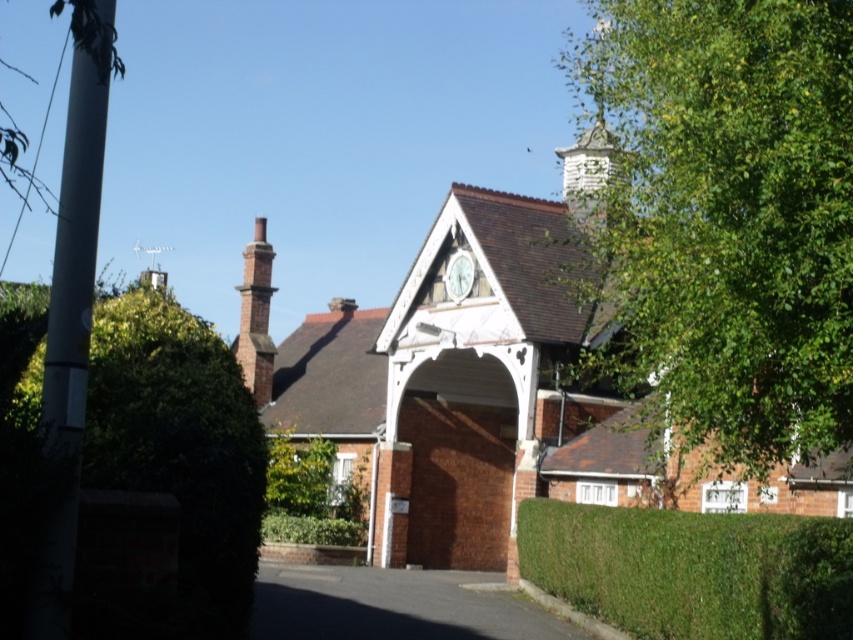
Question: Does green leafy hedge at lower right have a greater width compared to white textured chimney at upper right?

Choices:
 (A) no
 (B) yes

Answer: (A)

Question: Estimate the real-world distances between objects in this image. Which object is closer to the green leafy hedge at lower right?

Choices:
 (A) brick chimney at center-left
 (B) dark gray asphalt at center
 (C) white textured chimney at upper right
 (D) white plastic pole at left

Answer: (B)

Question: Which point is closer to the camera?

Choices:
 (A) (758, 308)
 (B) (579, 154)
 (C) (238, 472)
 (D) (70, 353)

Answer: (D)

Question: Among these objects, which one is nearest to the camera?

Choices:
 (A) green leafy tree at left
 (B) white textured chimney at upper right
 (C) green leafy hedge at lower right
 (D) brick chimney at center-left

Answer: (A)

Question: Does dark gray asphalt at center appear over brick chimney at center-left?

Choices:
 (A) no
 (B) yes

Answer: (A)

Question: Where is green leafy hedge at left located in relation to dark gray asphalt at center in the image?

Choices:
 (A) below
 (B) above

Answer: (B)